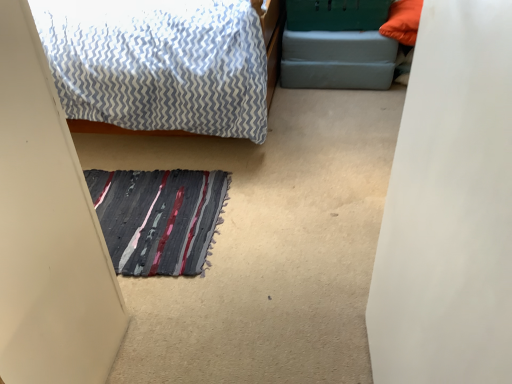
This screenshot has width=512, height=384. In order to click on textured wool doormat at center in this screenshot , I will do `click(158, 218)`.

What do you see at coordinates (158, 218) in the screenshot? I see `textured wool doormat at center` at bounding box center [158, 218].

Measure the distance between textured wool doormat at center and camera.

textured wool doormat at center is 4.57 feet from camera.

This screenshot has height=384, width=512. Identify the location of green plastic bed frame at upper center. (338, 46).

What do you see at coordinates (338, 46) in the screenshot? The image size is (512, 384). I see `green plastic bed frame at upper center` at bounding box center [338, 46].

Where is `textured wool doormat at center`? Image resolution: width=512 pixels, height=384 pixels. textured wool doormat at center is located at coordinates (158, 218).

Considering the positions of objects green plastic bed frame at upper center and textured wool doormat at center in the image provided, who is more to the left, green plastic bed frame at upper center or textured wool doormat at center?

textured wool doormat at center.

Is green plastic bed frame at upper center positioned before textured wool doormat at center?

No.

Which is behind, point (287, 40) or point (170, 216)?

The point (287, 40) is farther from the camera.

From the image's perspective, is green plastic bed frame at upper center on top of textured wool doormat at center?

Yes.

From a real-world perspective, is green plastic bed frame at upper center positioned above or below textured wool doormat at center?

Clearly, from a real-world perspective, green plastic bed frame at upper center is above textured wool doormat at center.

Which object is thinner, green plastic bed frame at upper center or textured wool doormat at center?

green plastic bed frame at upper center is thinner.

Does green plastic bed frame at upper center have a greater height compared to textured wool doormat at center?

Indeed, green plastic bed frame at upper center has a greater height compared to textured wool doormat at center.

Who is bigger, green plastic bed frame at upper center or textured wool doormat at center?

green plastic bed frame at upper center is bigger.

Is green plastic bed frame at upper center not within textured wool doormat at center?

Yes, green plastic bed frame at upper center is not within textured wool doormat at center.

Is green plastic bed frame at upper center far away from textured wool doormat at center?

Indeed, green plastic bed frame at upper center is not near textured wool doormat at center.

Could you tell me if green plastic bed frame at upper center is facing textured wool doormat at center?

Yes, green plastic bed frame at upper center is aimed at textured wool doormat at center.

Can you tell me how much green plastic bed frame at upper center and textured wool doormat at center differ in facing direction?

95.8 degrees.

Measure the distance from green plastic bed frame at upper center to textured wool doormat at center.

green plastic bed frame at upper center is 3.96 feet away from textured wool doormat at center.

Find the location of a particular element. The width and height of the screenshot is (512, 384). bed frame that appears on the right of textured wool doormat at center is located at coordinates (338, 46).

Which object is positioned more to the right, textured wool doormat at center or green plastic bed frame at upper center?

green plastic bed frame at upper center.

Is textured wool doormat at center in front of or behind green plastic bed frame at upper center in the image?

Visually, textured wool doormat at center is located in front of green plastic bed frame at upper center.

Which is in front, point (175, 233) or point (352, 69)?

The point (175, 233) is closer to the camera.

From the image's perspective, which is above, textured wool doormat at center or green plastic bed frame at upper center?

green plastic bed frame at upper center is shown above in the image.

From a real-world perspective, is textured wool doormat at center positioned under green plastic bed frame at upper center based on gravity?

Indeed, from a real-world perspective, textured wool doormat at center is positioned beneath green plastic bed frame at upper center.

Considering the sizes of objects textured wool doormat at center and green plastic bed frame at upper center in the image provided, who is thinner, textured wool doormat at center or green plastic bed frame at upper center?

green plastic bed frame at upper center is thinner.

Considering the sizes of objects textured wool doormat at center and green plastic bed frame at upper center in the image provided, who is shorter, textured wool doormat at center or green plastic bed frame at upper center?

textured wool doormat at center.

Can you confirm if textured wool doormat at center is smaller than green plastic bed frame at upper center?

Yes, textured wool doormat at center is smaller than green plastic bed frame at upper center.

Can green plastic bed frame at upper center be found inside textured wool doormat at center?

No, green plastic bed frame at upper center is not surrounded by textured wool doormat at center.

Is textured wool doormat at center in contact with green plastic bed frame at upper center?

textured wool doormat at center and green plastic bed frame at upper center are not in contact.

Is textured wool doormat at center facing towards green plastic bed frame at upper center?

No, textured wool doormat at center is not turned towards green plastic bed frame at upper center.

In the scene shown: Can you tell me how much textured wool doormat at center and green plastic bed frame at upper center differ in facing direction?

The angle between the facing direction of textured wool doormat at center and the facing direction of green plastic bed frame at upper center is 95.8 degrees.

Identify the location of doormat in front of the green plastic bed frame at upper center. This screenshot has height=384, width=512. (158, 218).

Where is `doormat in front of the green plastic bed frame at upper center`? doormat in front of the green plastic bed frame at upper center is located at coordinates (158, 218).

This screenshot has width=512, height=384. I want to click on bed frame to the right of textured wool doormat at center, so click(x=338, y=46).